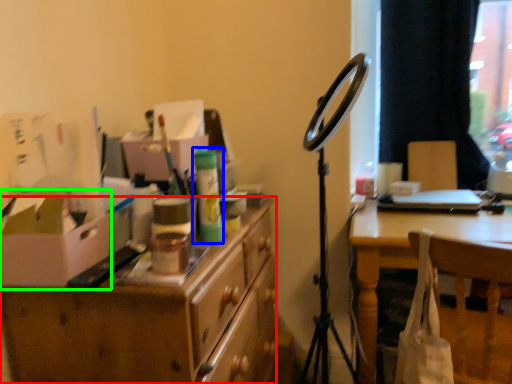
Question: Based on their relative distances, which object is nearer to desk (highlighted by a red box)? Choose from toiletry (highlighted by a blue box) and cardboard box (highlighted by a green box).

Choices:
 (A) toiletry
 (B) cardboard box

Answer: (B)